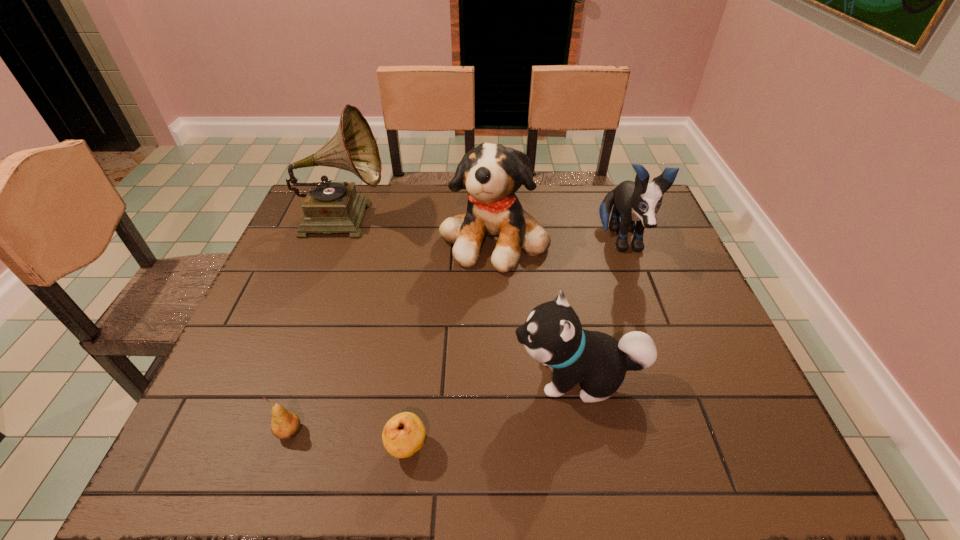
The width and height of the screenshot is (960, 540). I want to click on blank space at the left edge of the desktop, so click(x=300, y=300).

The height and width of the screenshot is (540, 960). Find the location of `vacant space at the right edge of the desktop`. vacant space at the right edge of the desktop is located at coordinates (707, 308).

This screenshot has height=540, width=960. What are the coordinates of `free space between the left pear and the third shortest object` in the screenshot? It's located at (434, 404).

I want to click on vacant space that's between the third shortest object and the record player, so click(x=461, y=297).

Identify the location of empty location between the left pear and the third nearest object. This screenshot has width=960, height=540. (434, 404).

Locate an element on the screen. This screenshot has height=540, width=960. free spot between the right pear and the left pear is located at coordinates (348, 439).

You are a GUI agent. You are given a task and a screenshot of the screen. Output one action in this format:
    pyautogui.click(x=<x>, y=<y>)
    Task: Click on the empty space that is in between the left pear and the fourth farthest object
    The height and width of the screenshot is (540, 960).
    Given the screenshot: What is the action you would take?
    pyautogui.click(x=434, y=404)

Identify the location of free space between the left pear and the record player. This screenshot has height=540, width=960. (316, 325).

Where is `vacant area that lies between the shortest puppy and the record player`? This screenshot has width=960, height=540. vacant area that lies between the shortest puppy and the record player is located at coordinates (461, 297).

Find the location of a particular element. The height and width of the screenshot is (540, 960). vacant space in between the fourth farthest object and the left pear is located at coordinates (434, 404).